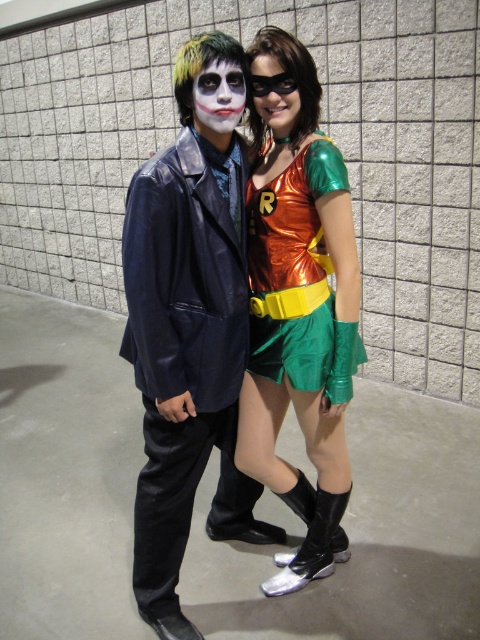
Question: Which object is farther from the camera taking this photo?

Choices:
 (A) metallic green shorts at center
 (B) metallic gold mask at center
 (C) matte white face at center

Answer: (B)

Question: Which is nearer to the metallic green shorts at center?

Choices:
 (A) metallic orange/green costume at center
 (B) metallic gold mask at center

Answer: (A)

Question: Observing the image, what is the correct spatial positioning of metallic green shorts at center in reference to metallic orange/green costume at center?

Choices:
 (A) left
 (B) right

Answer: (B)

Question: Which of the following is the closest to the observer?

Choices:
 (A) metallic gold mask at center
 (B) matte white face at center
 (C) shiny black suit at center
 (D) metallic orange/green costume at center

Answer: (C)

Question: Does metallic orange/green costume at center appear on the right side of metallic gold mask at center?

Choices:
 (A) yes
 (B) no

Answer: (A)

Question: Where is shiny black suit at center located in relation to metallic gold mask at center in the image?

Choices:
 (A) above
 (B) below

Answer: (B)